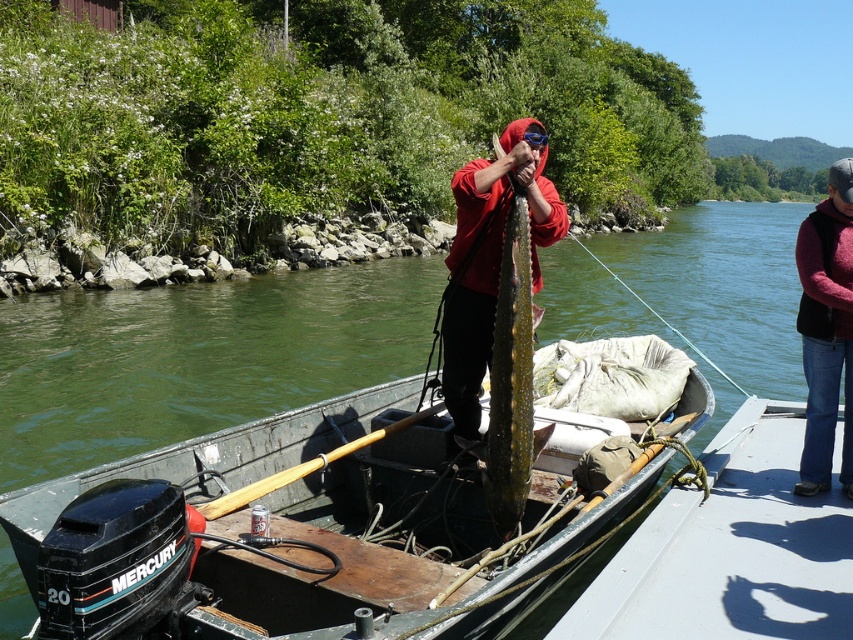
Is wooden boat at center above greenish-yellow textured fish at center?

Incorrect, wooden boat at center is not positioned above greenish-yellow textured fish at center.

Does wooden boat at center lie behind greenish-yellow textured fish at center?

That is False.

Locate an element on the screen. wooden boat at center is located at coordinates (335, 525).

Find the location of `wooden boat at center`. wooden boat at center is located at coordinates (335, 525).

Find the location of a particular element. wooden boat at center is located at coordinates (335, 525).

Does wooden boat at center appear on the left side of maroon sweater at right?

Indeed, wooden boat at center is positioned on the left side of maroon sweater at right.

Where is `wooden boat at center`? The height and width of the screenshot is (640, 853). wooden boat at center is located at coordinates (335, 525).

This screenshot has width=853, height=640. Find the location of `wooden boat at center`. wooden boat at center is located at coordinates (335, 525).

Which is more to the left, matte red hoodie at center or greenish-yellow textured fish at center?

From the viewer's perspective, matte red hoodie at center appears more on the left side.

Between point (457, 170) and point (506, 332), which one is positioned in front?

Point (506, 332)

The height and width of the screenshot is (640, 853). In order to click on matte red hoodie at center in this screenshot , I will do click(x=489, y=259).

Locate an element on the screen. The width and height of the screenshot is (853, 640). matte red hoodie at center is located at coordinates (489, 259).